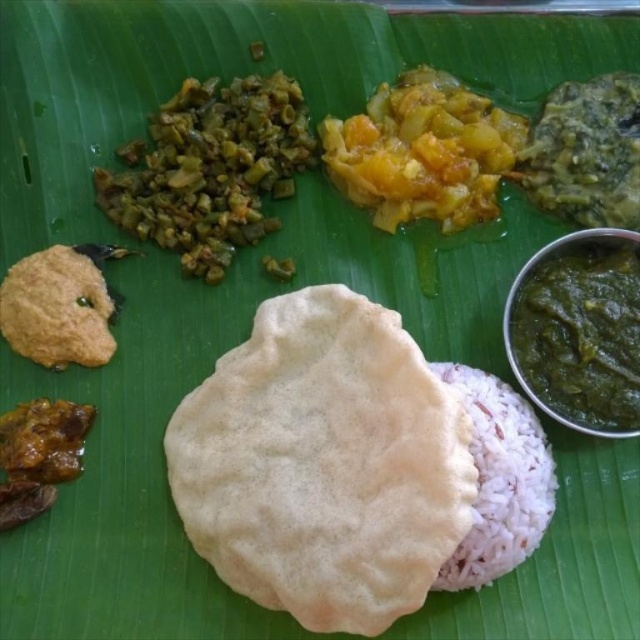
Question: Is white soft flatbread at center thinner than green paste at right?

Choices:
 (A) no
 (B) yes

Answer: (A)

Question: Does yellow-orange mashed food at center come behind white polished rice at center-right?

Choices:
 (A) no
 (B) yes

Answer: (B)

Question: Which object is the farthest from the brown crumbly paste at upper left?

Choices:
 (A) white polished rice at center-right
 (B) yellow-orange mashed food at center

Answer: (A)

Question: Which object appears farthest from the camera in this image?

Choices:
 (A) green paste at right
 (B) white polished rice at center-right
 (C) green leafy vegetable at upper right
 (D) brown crumbly food at lower left

Answer: (C)

Question: Does greenish-brown textured vegetable at upper left come behind brown crumbly food at lower left?

Choices:
 (A) yes
 (B) no

Answer: (A)

Question: Which point is closer to the camera taking this photo?

Choices:
 (A) (490, 506)
 (B) (52, 412)
 (C) (97, 301)
 (D) (272, 412)

Answer: (A)